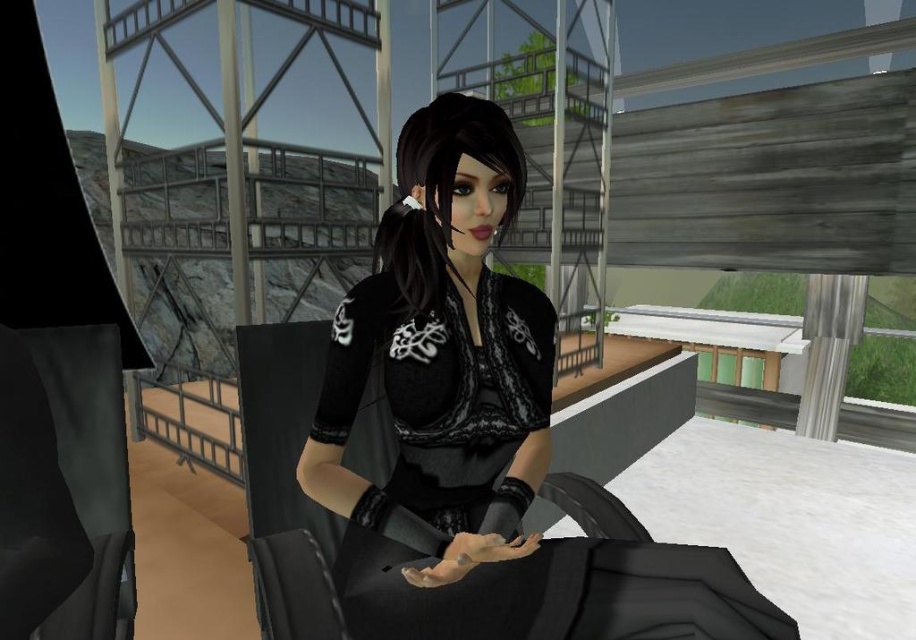
You are a fashion designer who needs to choose between the black satin dress at center and the black lace dress at center for a runway show. Based on their sizes, which dress would you recommend for a model with a petite frame?

The black lace dress at center is smaller than the black satin dress at center, so it would be more suitable for a model with a petite frame.

You are a fashion designer observing a runway show and notice two dresses at the center of the image. Which dress is taller, the black satin dress at center or the black lace dress at center?

The black satin dress at center is taller than the black lace dress at center.